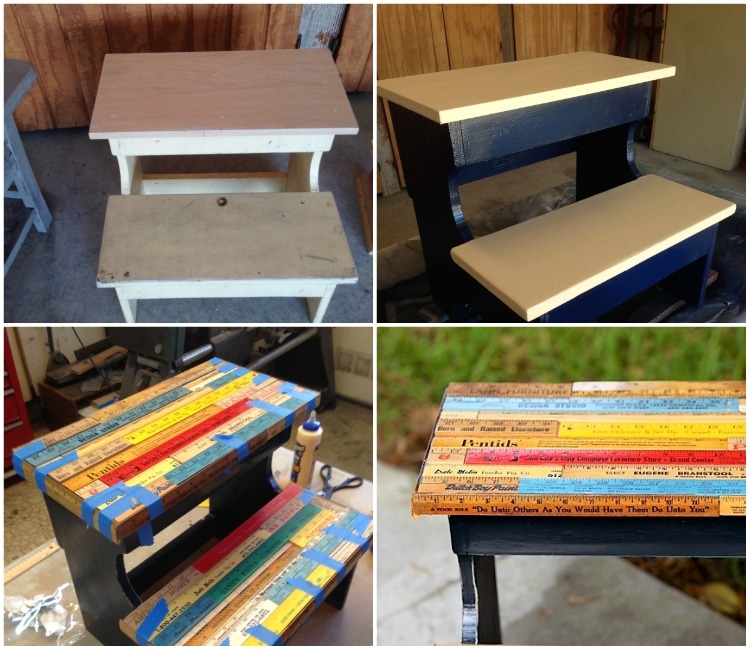
In order to click on cement wall in this screenshot , I will do `click(37, 344)`.